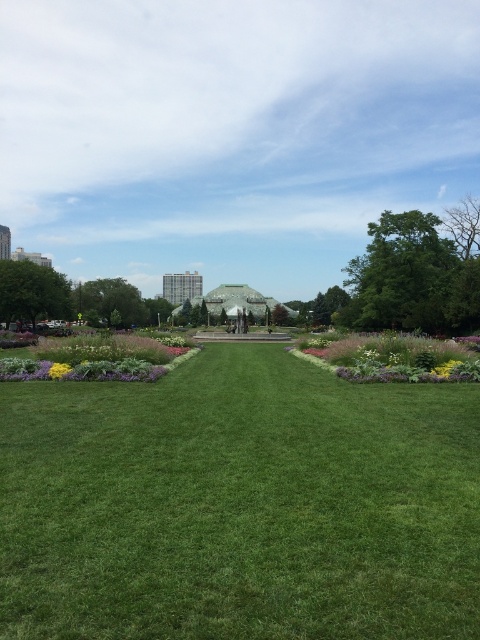
Question: Is yellow matte flower at lower left thinner than yellow matte flower at center?

Choices:
 (A) no
 (B) yes

Answer: (A)

Question: Is yellow matte flower at lower left bigger than yellow matte flower at center?

Choices:
 (A) yes
 (B) no

Answer: (A)

Question: Which object is closer to the camera taking this photo?

Choices:
 (A) yellow matte flower at lower left
 (B) green grass at center
 (C) green grass lawn at center
 (D) yellow matte flower at center

Answer: (C)

Question: Is green grass lawn at center above yellow matte flower at center?

Choices:
 (A) yes
 (B) no

Answer: (B)

Question: Considering the real-world distances, which object is farthest from the green grass lawn at center?

Choices:
 (A) yellow matte flower at lower left
 (B) yellow matte flower at center
 (C) green grass at center

Answer: (C)

Question: Among these objects, which one is farthest from the camera?

Choices:
 (A) green grass lawn at center
 (B) yellow matte flower at lower left
 (C) yellow matte flower at center

Answer: (C)